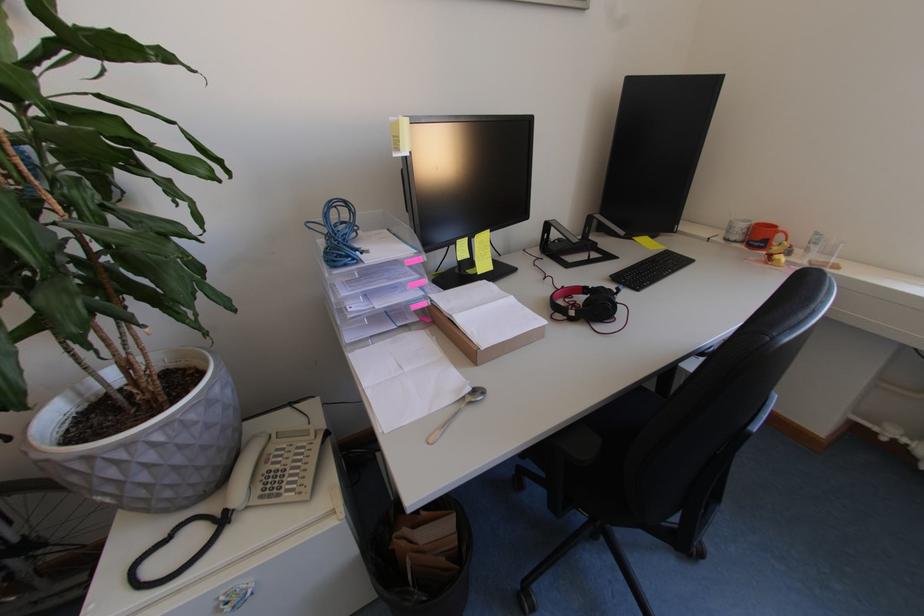
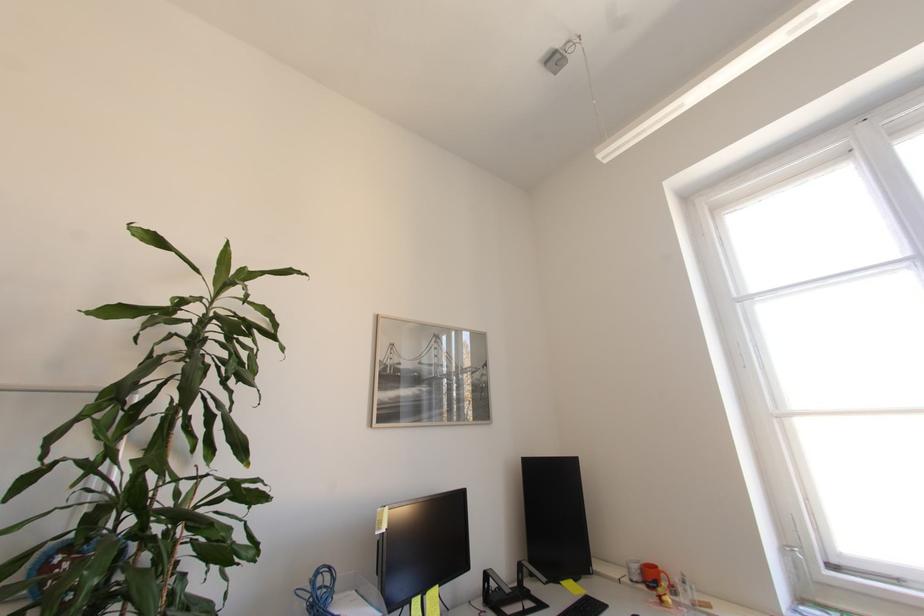
Question: The first image is from the beginning of the video and the second image is from the end. How did the camera likely rotate when shooting the video?

Choices:
 (A) Left
 (B) Right
 (C) Up
 (D) Down

Answer: (C)